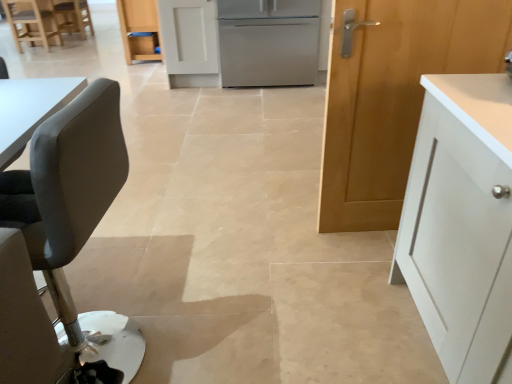
Question: Is matte gray chair at upper left, placed as the 1th chair when sorted from left to right, in front of or behind wooden chair at upper left, the second chair positioned from the left, in the image?

Choices:
 (A) behind
 (B) front

Answer: (B)

Question: Is point (13, 1) closer or farther from the camera than point (71, 29)?

Choices:
 (A) farther
 (B) closer

Answer: (B)

Question: Which object is positioned closest to the matte gray chair at upper left, placed as the 1th chair when sorted from left to right?

Choices:
 (A) matte gray chair at left, marked as the 3th chair in a left-to-right arrangement
 (B) wooden door at right, which appears as the 2th cabinetry when viewed from the top
 (C) matte wood cabinet at center, which appears as the 1th cabinetry when viewed from the back
 (D) stainless steel refrigerator at center
 (E) wooden chair at upper left, which is the first chair in top-to-bottom order

Answer: (E)

Question: Which of these objects is positioned closest to the wooden chair at upper left, acting as the 2th chair starting from the right?

Choices:
 (A) matte gray chair at left, marked as the 3th chair in a left-to-right arrangement
 (B) matte wood cabinet at center, arranged as the 1th cabinetry when viewed from the top
 (C) wooden door at right, which ranks as the 2th cabinetry in back-to-front order
 (D) matte gray chair at upper left, marked as the second chair in a front-to-back arrangement
 (E) stainless steel refrigerator at center

Answer: (D)